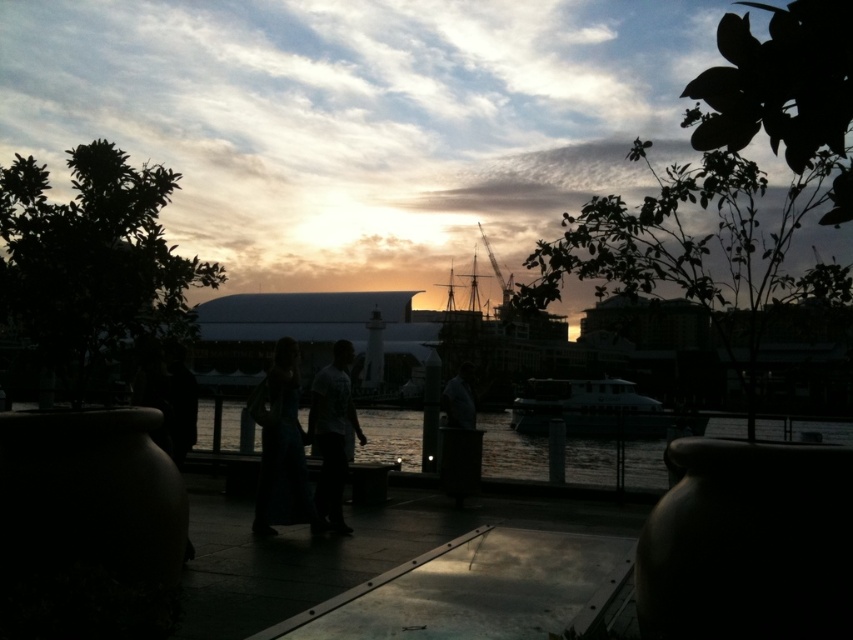
Question: Estimate the real-world distances between objects in this image. Which object is farther from the light brown fabric shirt at center?

Choices:
 (A) matte green dress at center
 (B) dark gray fabric jacket at center

Answer: (B)

Question: Which is farther from the dark gray fabric jacket at center?

Choices:
 (A) white glossy boat at center
 (B) light brown fabric shirt at center

Answer: (A)

Question: Considering the relative positions of white glossy boat at center and dark gray fabric jacket at center in the image provided, where is white glossy boat at center located with respect to dark gray fabric jacket at center?

Choices:
 (A) right
 (B) left

Answer: (A)

Question: Which object is the closest to the matte green dress at center?

Choices:
 (A) dark gray fabric jacket at center
 (B) white glossy boat at center

Answer: (A)

Question: Can you confirm if white glossy boat at center is thinner than light brown fabric shirt at center?

Choices:
 (A) yes
 (B) no

Answer: (B)

Question: Does transparent glass water at center lie in front of dark gray fabric jacket at center?

Choices:
 (A) no
 (B) yes

Answer: (A)